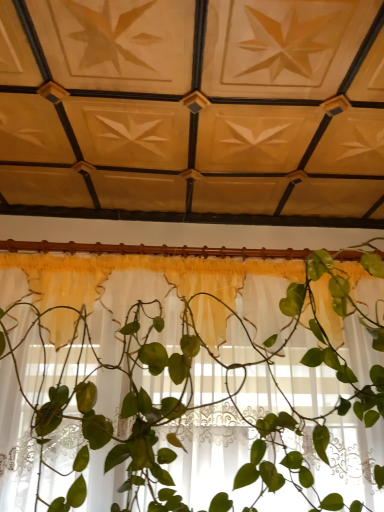
Question: Should I look upward or downward to see translucent white curtain at center?

Choices:
 (A) down
 (B) up

Answer: (A)